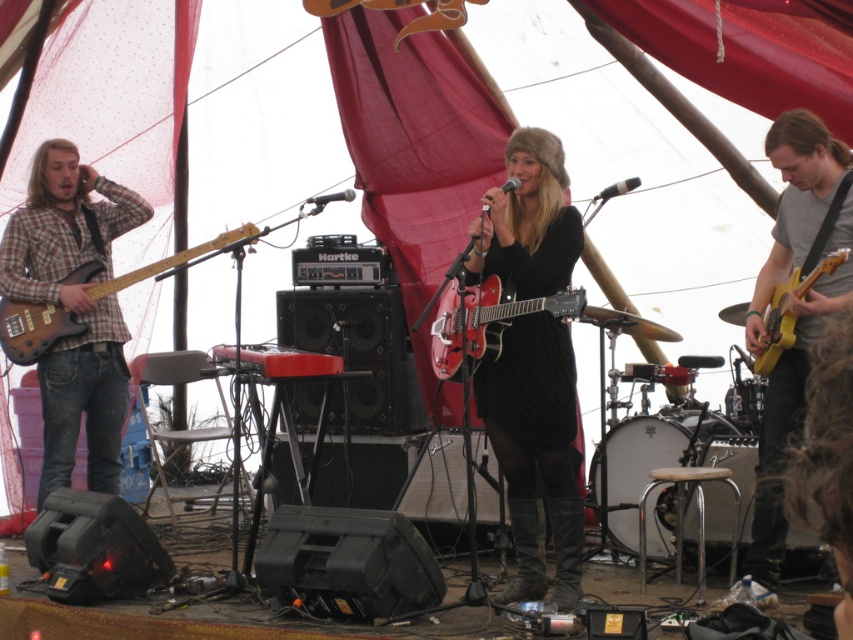
Based on the photo, does brown plaid shirt at left appear on the left side of wooden electric guitar at left?

Indeed, brown plaid shirt at left is positioned on the left side of wooden electric guitar at left.

Is point (115, 416) positioned after point (15, 337)?

Yes.

The image size is (853, 640). In order to click on brown plaid shirt at left in this screenshot , I will do `click(73, 308)`.

Who is shorter, shiny red electric guitar at center or yellow matte electric guitar at right?

shiny red electric guitar at center is shorter.

Is the position of shiny red electric guitar at center less distant than that of yellow matte electric guitar at right?

No.

Identify the location of shiny red electric guitar at center. This screenshot has height=640, width=853. (488, 321).

I want to click on brown plaid shirt at left, so click(73, 308).